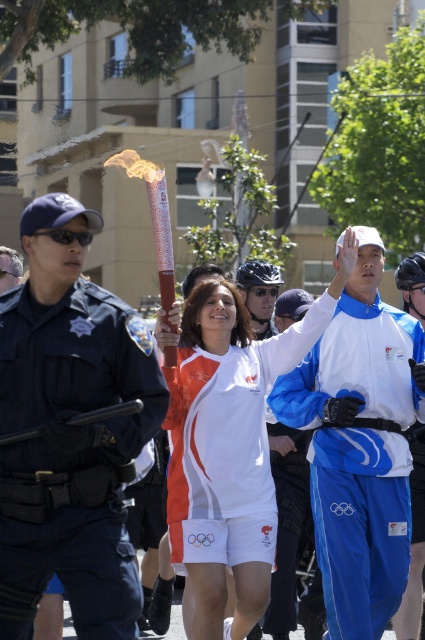
Consider the image. Who is positioned more to the right, blue synthetic jacket at center or white fabric shirt at center?

blue synthetic jacket at center

Does point (317, 506) come farther from viewer compared to point (339, 250)?

No, it is in front of (339, 250).

Image resolution: width=425 pixels, height=640 pixels. Identify the location of blue synthetic jacket at center. (359, 445).

Is blue uniformed officer at left wider than white fabric shirt at center?

Incorrect, blue uniformed officer at left's width does not surpass white fabric shirt at center's.

Between blue uniformed officer at left and white fabric shirt at center, which one is positioned higher?

white fabric shirt at center

Is point (150, 352) farther from viewer compared to point (206, 440)?

No, (150, 352) is closer to viewer.

Where is `blue uniformed officer at left`? The image size is (425, 640). blue uniformed officer at left is located at coordinates (70, 429).

Is white fabric shirt at center positioned in front of black uniform at left?

Yes.

Measure the distance from white fabric shirt at center to black uniform at left.

white fabric shirt at center and black uniform at left are 2.43 meters apart.

Is point (201, 332) positioned in front of point (8, 278)?

Yes, it is.

I want to click on white fabric shirt at center, so click(249, 372).